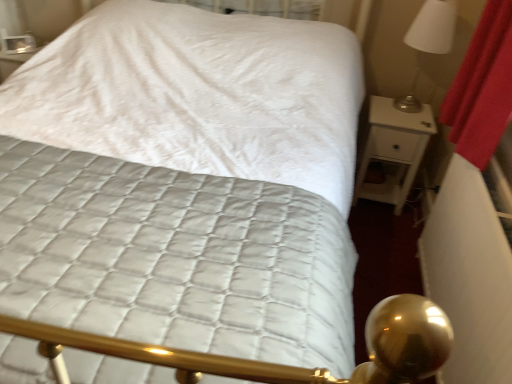
The height and width of the screenshot is (384, 512). I want to click on free point below white glossy lampshade at upper right (from a real-world perspective), so click(x=401, y=103).